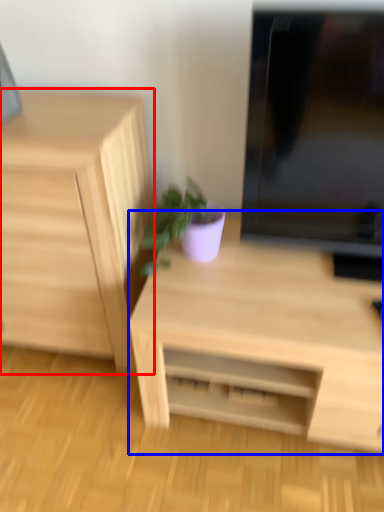
Question: Which of the following is the closest to the observer, chest of drawers (highlighted by a red box) or desk (highlighted by a blue box)?

Choices:
 (A) chest of drawers
 (B) desk

Answer: (B)